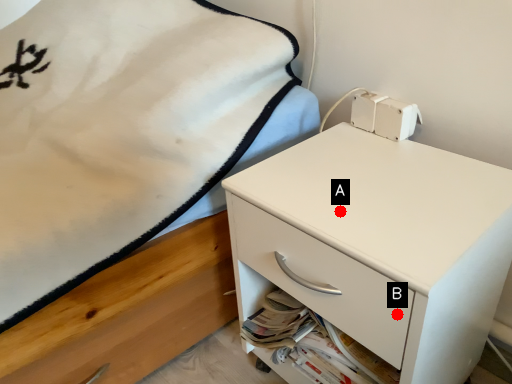
Question: Two points are circled on the image, labeled by A and B beside each circle. Which point is closer to the camera?

Choices:
 (A) A is closer
 (B) B is closer

Answer: (B)